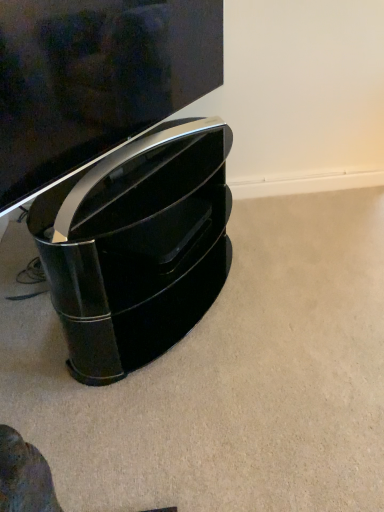
Question: Considering the positions of point coord(66,46) and point coord(36,234), is point coord(66,46) closer or farther from the camera than point coord(36,234)?

Choices:
 (A) closer
 (B) farther

Answer: (A)

Question: Visually, is glossy black tv at upper center positioned to the left or to the right of glossy black speaker at lower left?

Choices:
 (A) right
 (B) left

Answer: (B)

Question: From a real-world perspective, relative to glossy black speaker at lower left, is glossy black tv at upper center vertically above or below?

Choices:
 (A) below
 (B) above

Answer: (B)

Question: Choose the correct answer: Is glossy black speaker at lower left inside glossy black tv at upper center or outside it?

Choices:
 (A) outside
 (B) inside

Answer: (A)

Question: Looking at their shapes, would you say glossy black speaker at lower left is wider or thinner than glossy black tv at upper center?

Choices:
 (A) thin
 (B) wide

Answer: (B)

Question: Is glossy black speaker at lower left to the left or to the right of glossy black tv at upper center in the image?

Choices:
 (A) right
 (B) left

Answer: (A)

Question: Is glossy black speaker at lower left taller or shorter than glossy black tv at upper center?

Choices:
 (A) tall
 (B) short

Answer: (A)